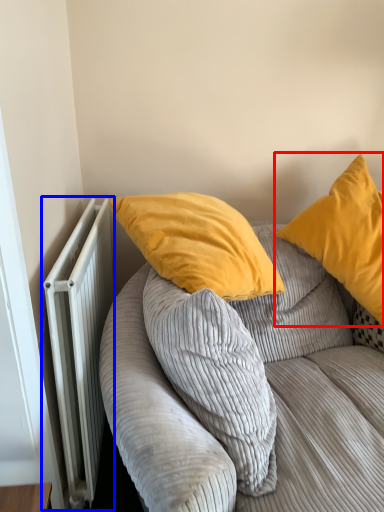
Question: Which object appears closest to the camera in this image, pillow (highlighted by a red box) or radiator (highlighted by a blue box)?

Choices:
 (A) pillow
 (B) radiator

Answer: (B)